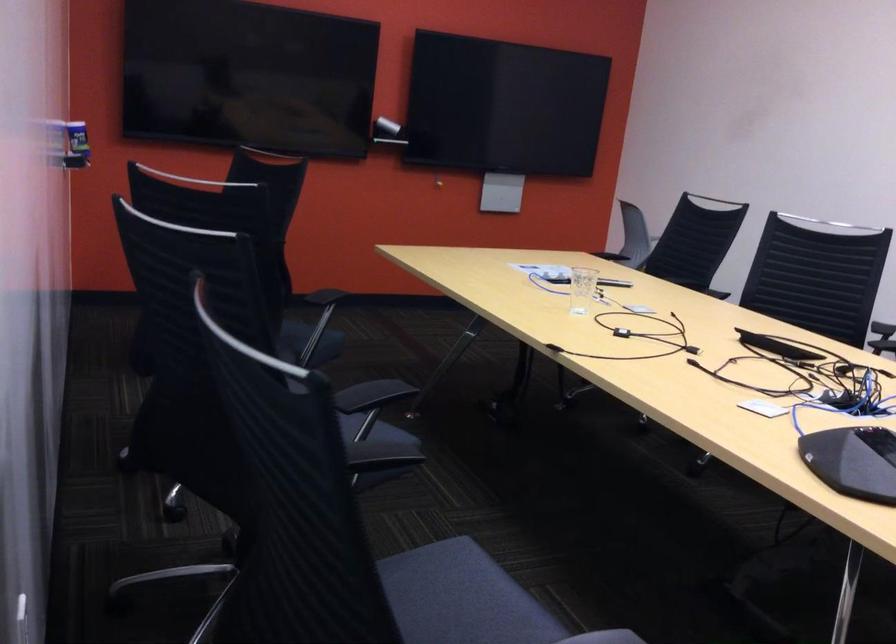
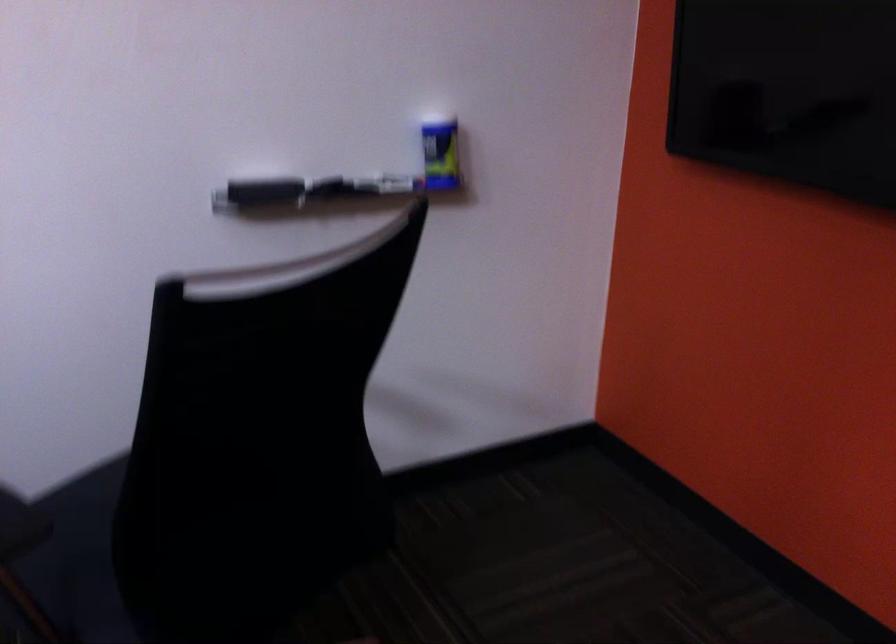
Where in the second image is the point corresponding to (x=85, y=140) from the first image?

(355, 181)